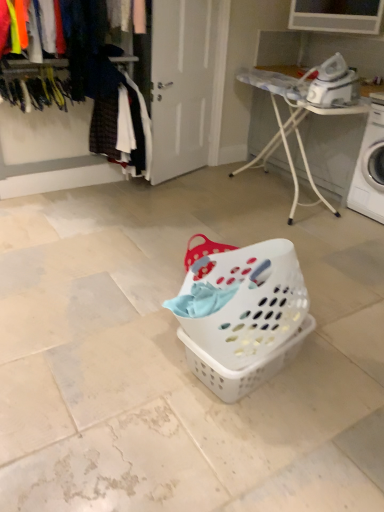
At what (x,y) coordinates should I click in order to perform the action: click on spots to the right of white plastic laundry basket at center. Please return your answer as a coordinate pair (x, y). Image resolution: width=384 pixels, height=512 pixels. Looking at the image, I should click on (340, 369).